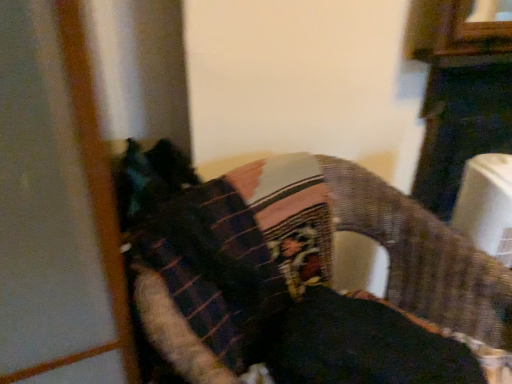
Locate an element on the screen. The height and width of the screenshot is (384, 512). velvet cushion at lower left is located at coordinates (298, 260).

In order to face velvet cushion at lower left, should I rotate leftwards or rightwards?

Rotate right and turn 9.974 degrees.

The image size is (512, 384). Describe the element at coordinates (298, 260) in the screenshot. I see `velvet cushion at lower left` at that location.

Where is `velvet cushion at lower left`? This screenshot has width=512, height=384. velvet cushion at lower left is located at coordinates (298, 260).